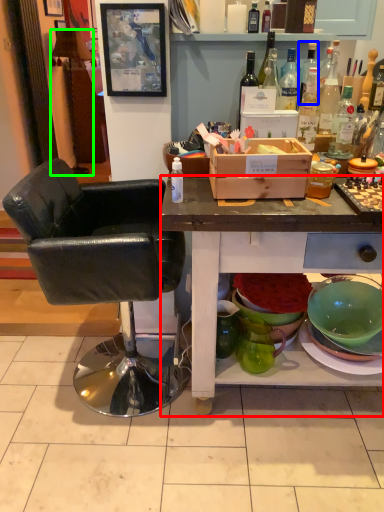
Question: Which is nearer to the desk (highlighted by a red box)? bottle (highlighted by a blue box) or lamp (highlighted by a green box).

Choices:
 (A) bottle
 (B) lamp

Answer: (A)